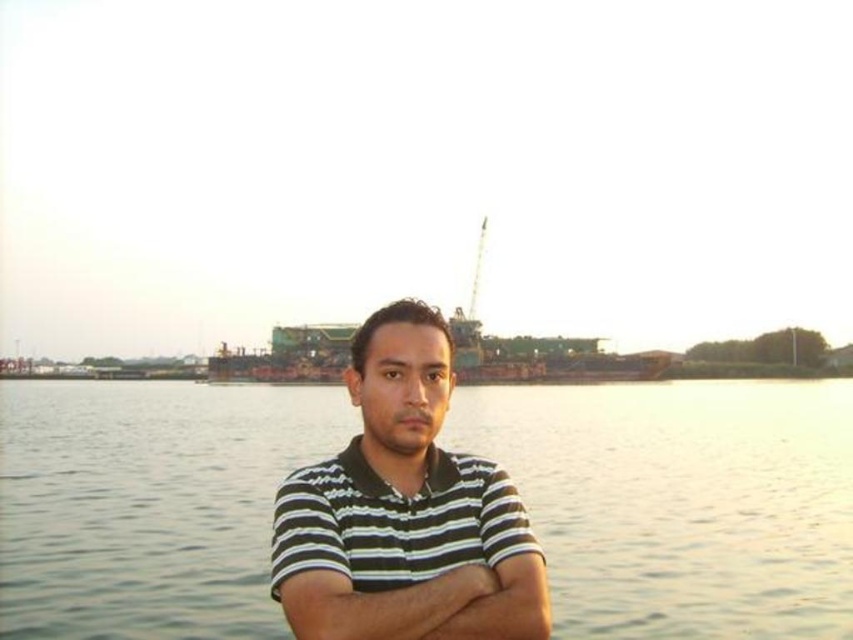
Is striped cotton shirt at center above white striped shirt at center?

Indeed, striped cotton shirt at center is positioned over white striped shirt at center.

Is point (445, 349) positioned after point (457, 611)?

Yes, point (445, 349) is behind point (457, 611).

Is point (384, 340) closer to viewer compared to point (289, 541)?

No, (384, 340) is further to viewer.

The width and height of the screenshot is (853, 640). In order to click on striped cotton shirt at center in this screenshot , I will do `click(405, 512)`.

At what (x,y) coordinates should I click in order to perform the action: click on striped cotton shirt at center. Please return your answer as a coordinate pair (x, y). The height and width of the screenshot is (640, 853). Looking at the image, I should click on (405, 512).

Is striped cotton shirt at center positioned at the back of striped fabric arm at center?

No.

Locate an element on the screen. striped cotton shirt at center is located at coordinates (405, 512).

Where is `striped cotton shirt at center`? The width and height of the screenshot is (853, 640). striped cotton shirt at center is located at coordinates (405, 512).

In the scene shown: How much distance is there between clear water at center and white striped shirt at center?

The distance of clear water at center from white striped shirt at center is 155.70 feet.

Identify the location of clear water at center. (680, 500).